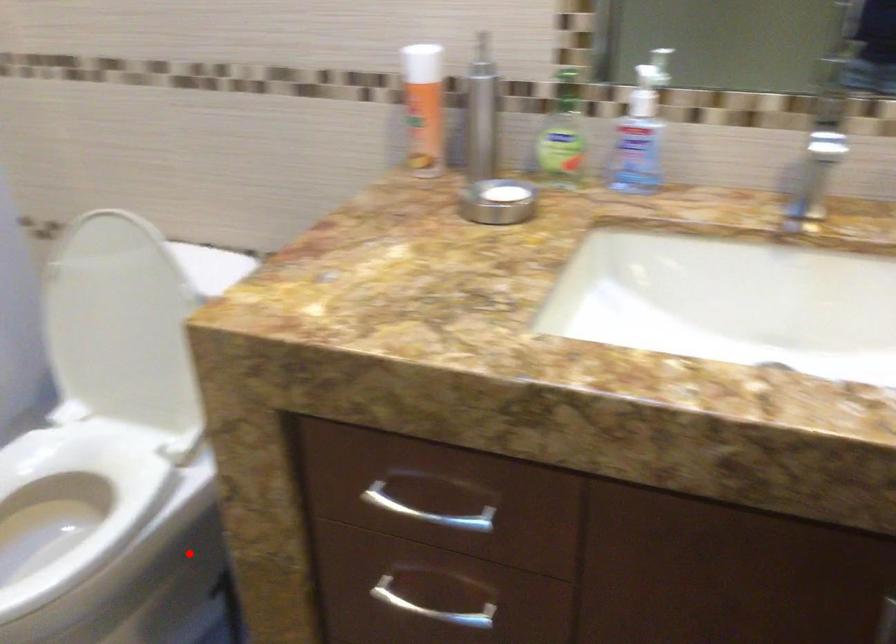
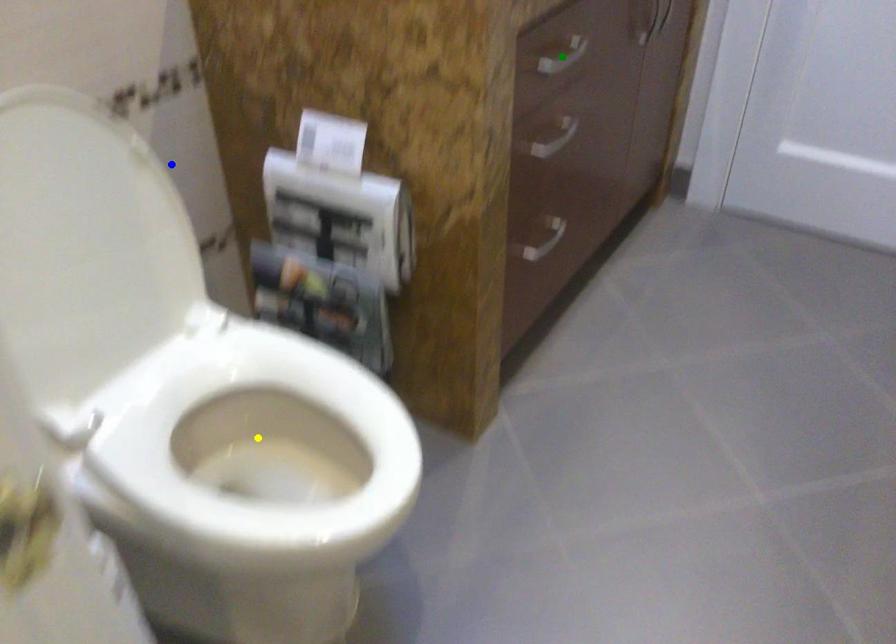
Question: I am providing you with two images of the same scene from different viewpoints. A red point is marked on the first image. You are given multiple points on the second image. Which point in image 2 is actually the same real-world point as the red point in image 1?

Choices:
 (A) green point
 (B) blue point
 (C) yellow point

Answer: (C)